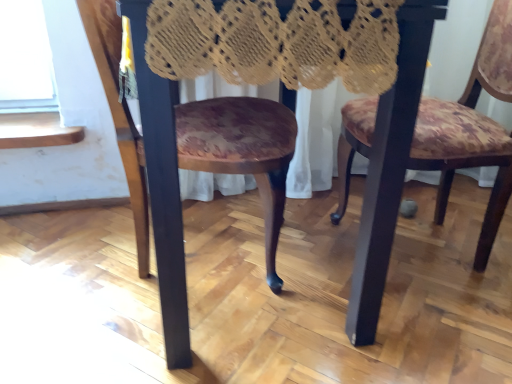
This screenshot has height=384, width=512. I want to click on vacant space in wooden table at center (from a real-world perspective), so click(x=292, y=267).